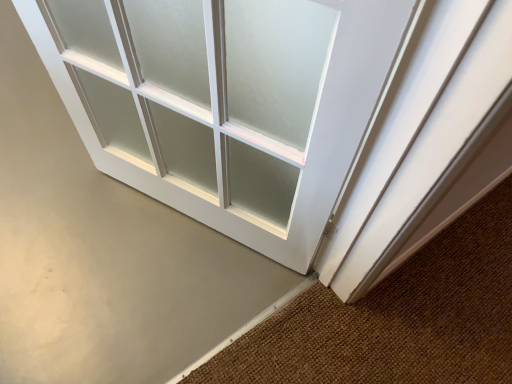
Question: From the image's perspective, is brown textured doormat at lower right above or below white frosted glass door at center?

Choices:
 (A) above
 (B) below

Answer: (B)

Question: Relative to white frosted glass door at center, is brown textured doormat at lower right in front or behind?

Choices:
 (A) behind
 (B) front

Answer: (B)

Question: Considering the relative positions of brown textured doormat at lower right and white frosted glass door at center in the image provided, is brown textured doormat at lower right to the left or to the right of white frosted glass door at center?

Choices:
 (A) left
 (B) right

Answer: (B)

Question: Considering the positions of white frosted glass door at center and brown textured doormat at lower right in the image, is white frosted glass door at center bigger or smaller than brown textured doormat at lower right?

Choices:
 (A) small
 (B) big

Answer: (B)

Question: Is point (281, 82) closer or farther from the camera than point (205, 367)?

Choices:
 (A) closer
 (B) farther

Answer: (A)

Question: Visually, is white frosted glass door at center positioned to the left or to the right of brown textured doormat at lower right?

Choices:
 (A) left
 (B) right

Answer: (A)

Question: From the image's perspective, is white frosted glass door at center positioned above or below brown textured doormat at lower right?

Choices:
 (A) below
 (B) above

Answer: (B)